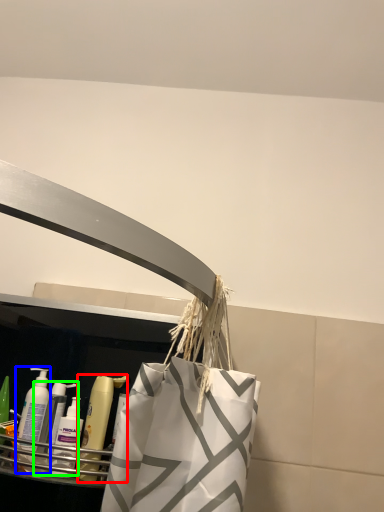
Question: Which is nearer to the mouthwash (highlighted by a red box)? cleaning product (highlighted by a blue box) or cleaning product (highlighted by a green box).

Choices:
 (A) cleaning product
 (B) cleaning product

Answer: (B)